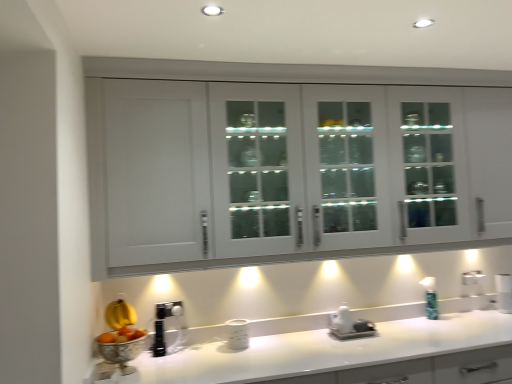
Question: Is white glossy countertop at lower center shorter than green glass soap dispenser at right?

Choices:
 (A) no
 (B) yes

Answer: (A)

Question: Is green glass soap dispenser at right located within white glossy countertop at lower center?

Choices:
 (A) no
 (B) yes

Answer: (B)

Question: From a real-world perspective, is white glossy countertop at lower center below green glass soap dispenser at right?

Choices:
 (A) no
 (B) yes

Answer: (B)

Question: Is white glossy countertop at lower center positioned beyond the bounds of green glass soap dispenser at right?

Choices:
 (A) yes
 (B) no

Answer: (A)

Question: Is white glossy countertop at lower center closer to the viewer compared to green glass soap dispenser at right?

Choices:
 (A) no
 (B) yes

Answer: (B)

Question: Would you say white glossy cabinet at upper center is inside or outside green glass soap dispenser at right?

Choices:
 (A) outside
 (B) inside

Answer: (A)

Question: In terms of width, does white glossy cabinet at upper center look wider or thinner when compared to green glass soap dispenser at right?

Choices:
 (A) wide
 (B) thin

Answer: (A)

Question: Considering their positions, is white glossy cabinet at upper center located in front of or behind green glass soap dispenser at right?

Choices:
 (A) behind
 (B) front

Answer: (B)

Question: Visually, is white glossy cabinet at upper center positioned to the left or to the right of green glass soap dispenser at right?

Choices:
 (A) left
 (B) right

Answer: (A)

Question: Would you say white glossy cabinet at upper center is to the left or to the right of white glossy countertop at lower center in the picture?

Choices:
 (A) left
 (B) right

Answer: (A)

Question: Considering the positions of white glossy cabinet at upper center and white glossy countertop at lower center in the image, is white glossy cabinet at upper center taller or shorter than white glossy countertop at lower center?

Choices:
 (A) tall
 (B) short

Answer: (A)

Question: Is white glossy cabinet at upper center wider or thinner than white glossy countertop at lower center?

Choices:
 (A) thin
 (B) wide

Answer: (A)

Question: In terms of size, does white glossy cabinet at upper center appear bigger or smaller than white glossy countertop at lower center?

Choices:
 (A) big
 (B) small

Answer: (A)

Question: Relative to white glossy countertop at lower center, is green glass soap dispenser at right in front or behind?

Choices:
 (A) behind
 (B) front

Answer: (A)

Question: Considering the positions of green glass soap dispenser at right and white glossy countertop at lower center in the image, is green glass soap dispenser at right bigger or smaller than white glossy countertop at lower center?

Choices:
 (A) big
 (B) small

Answer: (B)